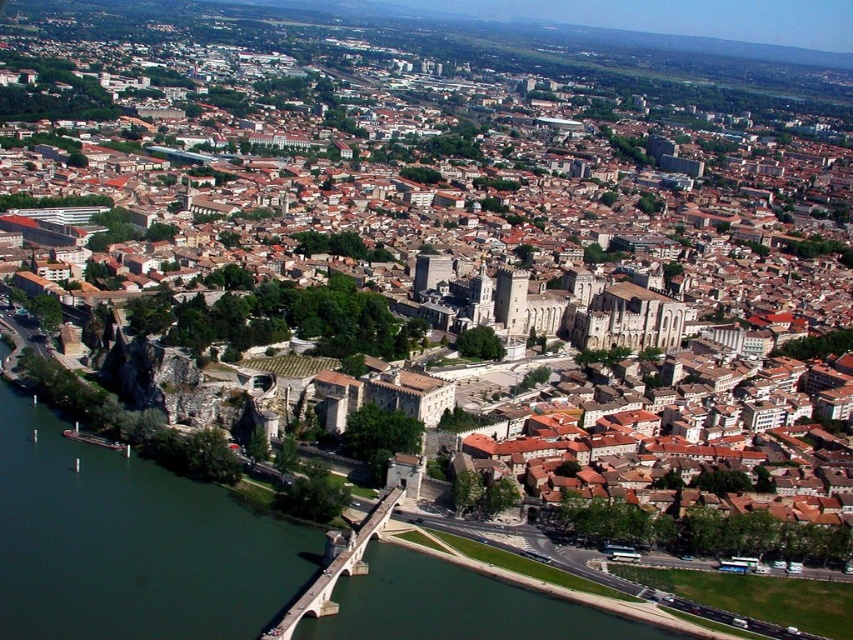
Does green water at lower left have a greater width compared to stone bridge at lower center?

Yes.

Describe the element at coordinates (131, 544) in the screenshot. This screenshot has height=640, width=853. I see `green water at lower left` at that location.

Measure the distance between point (207, 540) and camera.

The distance of point (207, 540) from camera is 502.49 feet.

Locate an element on the screen. green water at lower left is located at coordinates (131, 544).